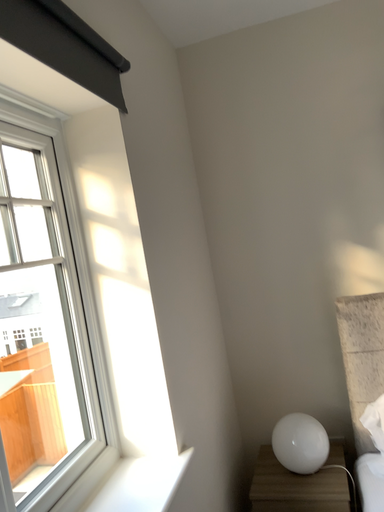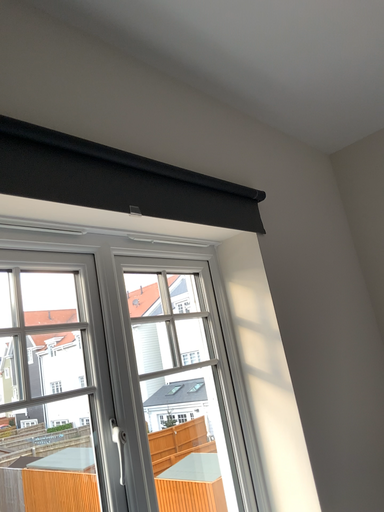
Question: How did the camera likely rotate when shooting the video?

Choices:
 (A) rotated upward
 (B) rotated downward

Answer: (A)